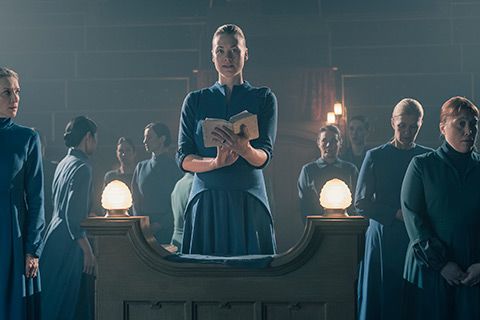
Identify the location of wooden stairs. Image resolution: width=480 pixels, height=320 pixels. (370, 85), (357, 62), (348, 37), (168, 31), (162, 66), (148, 88), (116, 125).